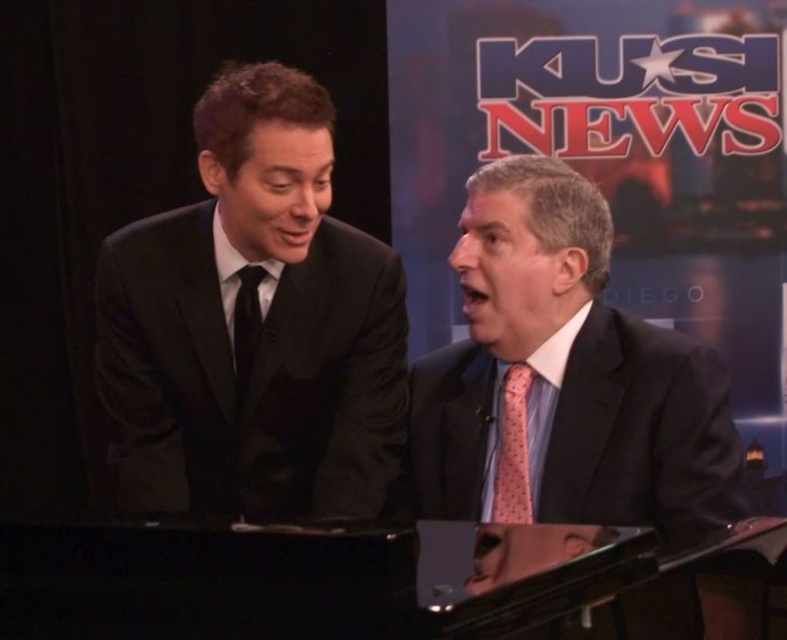
Does satin black suit at left have a greater height compared to black silk tie at left?

Correct, satin black suit at left is much taller as black silk tie at left.

Does satin black suit at left have a smaller size compared to black silk tie at left?

Incorrect, satin black suit at left is not smaller in size than black silk tie at left.

Between point (396, 326) and point (239, 376), which one is positioned behind?

Positioned behind is point (396, 326).

This screenshot has width=787, height=640. I want to click on satin black suit at left, so click(x=260, y=324).

Which is above, pink dotted tie at center or pink dotted fabric tie at center?

pink dotted tie at center is higher up.

Does pink dotted tie at center appear on the right side of pink dotted fabric tie at center?

Indeed, pink dotted tie at center is positioned on the right side of pink dotted fabric tie at center.

In order to click on pink dotted tie at center in this screenshot , I will do `click(564, 378)`.

Where is `pink dotted tie at center`? This screenshot has height=640, width=787. pink dotted tie at center is located at coordinates (564, 378).

Which is below, satin black suit at left or pink dotted fabric tie at center?

pink dotted fabric tie at center

Measure the distance between satin black suit at left and camera.

1.51 meters

Who is more distant from viewer, [348,369] or [499,406]?

Positioned behind is point [348,369].

This screenshot has width=787, height=640. I want to click on satin black suit at left, so click(x=260, y=324).